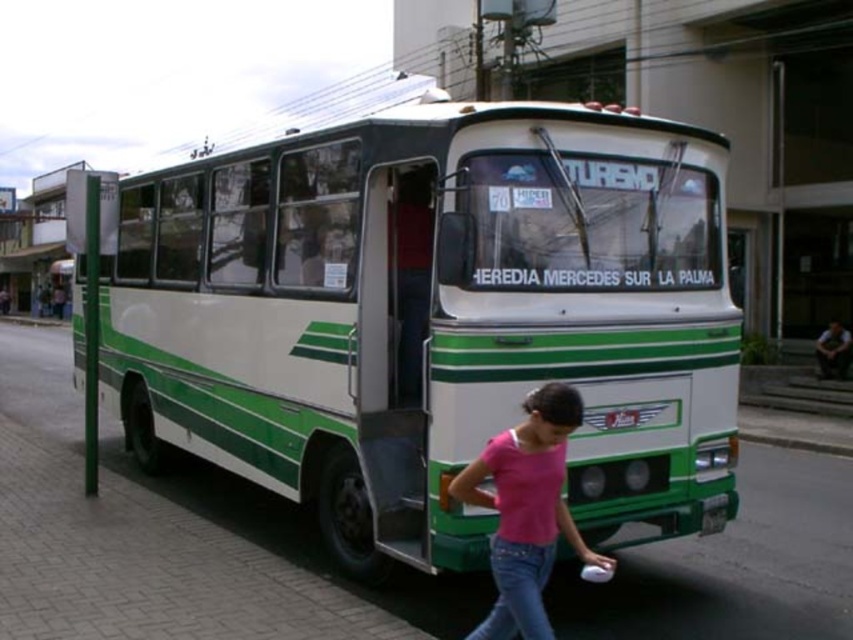
Does white/green painted bus at center have a greater width compared to pink matte shirt at lower center?

No, white/green painted bus at center is not wider than pink matte shirt at lower center.

Consider the image. How far apart are white/green painted bus at center and pink matte shirt at lower center?

A distance of 4.36 feet exists between white/green painted bus at center and pink matte shirt at lower center.

Which is behind, point (263, 336) or point (480, 460)?

The point (263, 336) is behind.

I want to click on white/green painted bus at center, so click(434, 317).